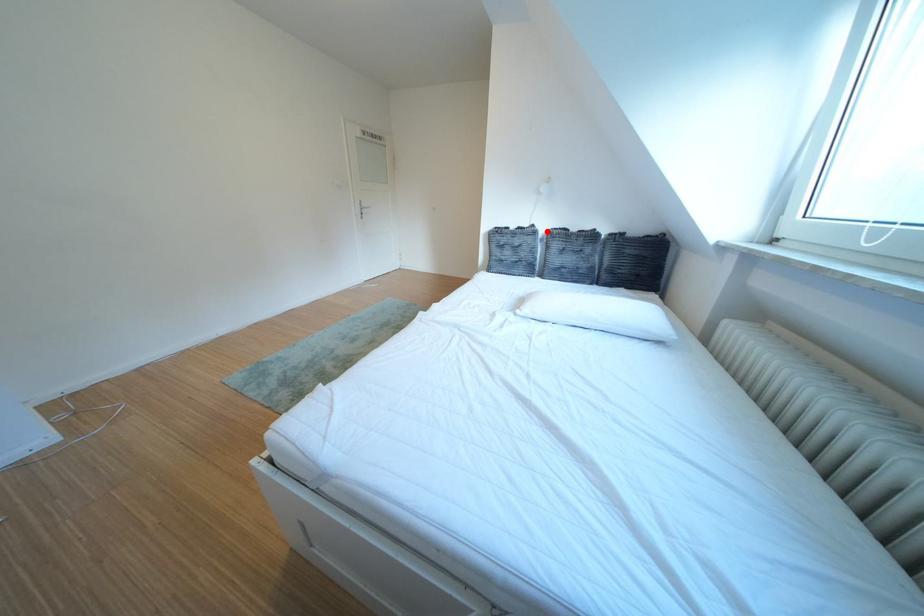
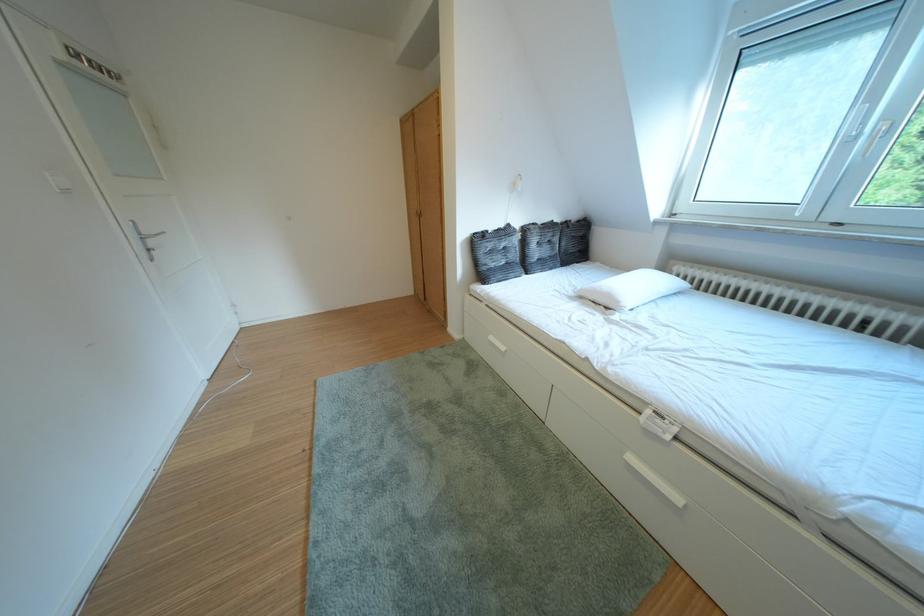
Question: I am providing you with two images of the same scene from different viewpoints. A red point is marked on the first image. At the location where the point appears in image 1, is it still visible in image 2?

Choices:
 (A) Yes
 (B) No

Answer: (A)